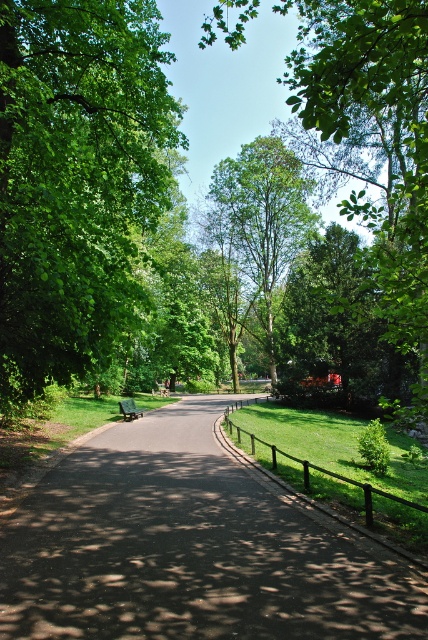
Question: Which of these objects is positioned farthest from the dark asphalt path at center?

Choices:
 (A) green leafy tree at center
 (B) green wooden bench at center
 (C) green leafy tree at left

Answer: (A)

Question: Is green leafy tree at left thinner than green leafy tree at center?

Choices:
 (A) yes
 (B) no

Answer: (A)

Question: Is green leafy tree at center to the left of green wooden bench at center from the viewer's perspective?

Choices:
 (A) no
 (B) yes

Answer: (A)

Question: Does green leafy tree at center appear under green wooden bench at center?

Choices:
 (A) no
 (B) yes

Answer: (A)

Question: Which of the following is the farthest from the observer?

Choices:
 (A) green wooden bench at center
 (B) dark asphalt path at center

Answer: (A)

Question: Which point is closer to the camera?

Choices:
 (A) dark asphalt path at center
 (B) green wooden bench at center

Answer: (A)